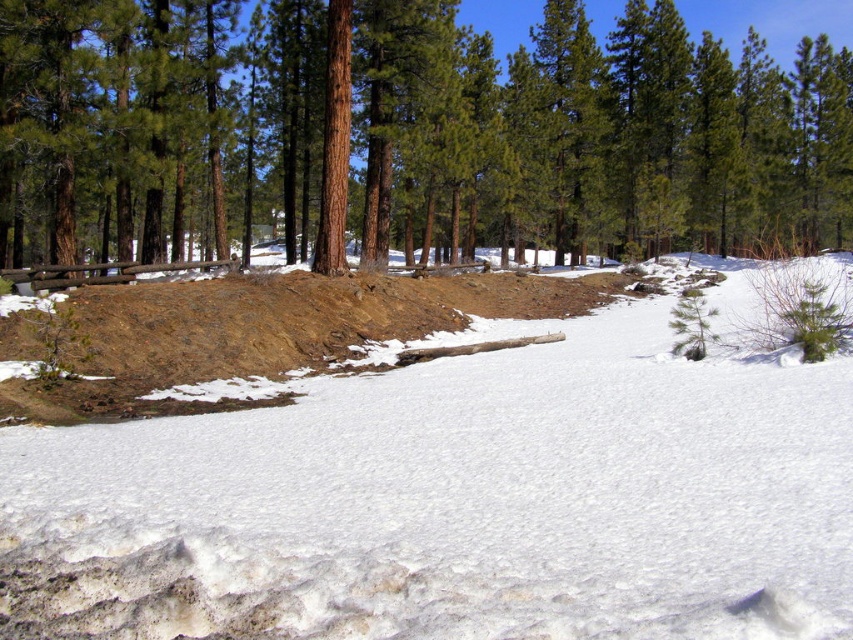
Which is more to the right, white fluffy snow at center or brown textured log at center?

Positioned to the right is brown textured log at center.

Can you confirm if white fluffy snow at center is positioned below brown textured log at center?

Yes.

Measure the distance between point (561, 520) and camera.

Point (561, 520) and camera are 3.93 meters apart.

In order to click on white fluffy snow at center in this screenshot , I will do `click(456, 502)`.